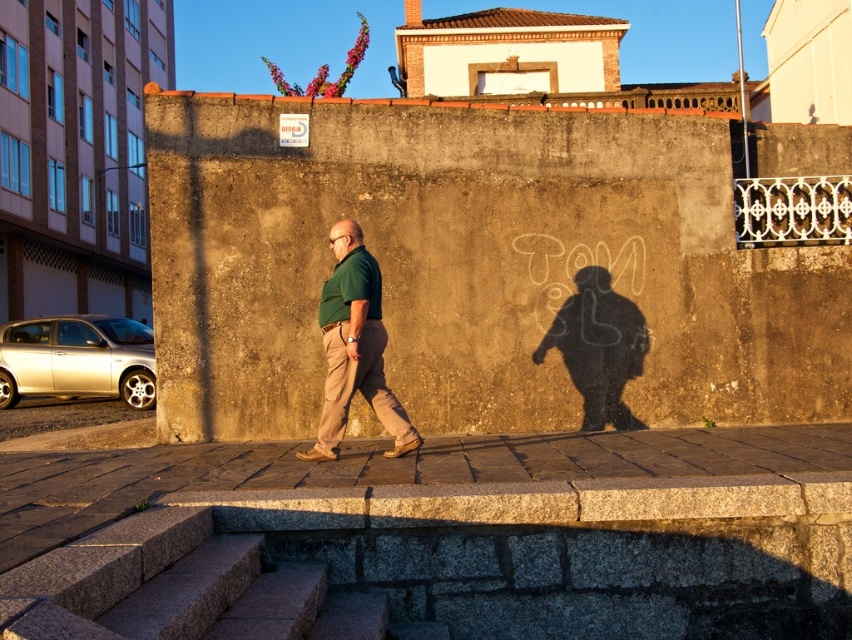
Question: Is granite pavement at center to the left of granite steps at lower left from the viewer's perspective?

Choices:
 (A) no
 (B) yes

Answer: (B)

Question: Which object is positioned closest to the granite steps at lower left?

Choices:
 (A) green matte shirt at center
 (B) granite pavement at center

Answer: (A)

Question: Does granite pavement at center have a lesser width compared to granite steps at lower left?

Choices:
 (A) no
 (B) yes

Answer: (B)

Question: Which point is farther to the camera?

Choices:
 (A) granite steps at lower left
 (B) granite pavement at center
 (C) green matte shirt at center

Answer: (B)

Question: Estimate the real-world distances between objects in this image. Which object is farther from the granite steps at lower left?

Choices:
 (A) granite pavement at center
 (B) green matte shirt at center

Answer: (A)

Question: Does granite steps at lower left appear on the left side of green matte shirt at center?

Choices:
 (A) yes
 (B) no

Answer: (A)